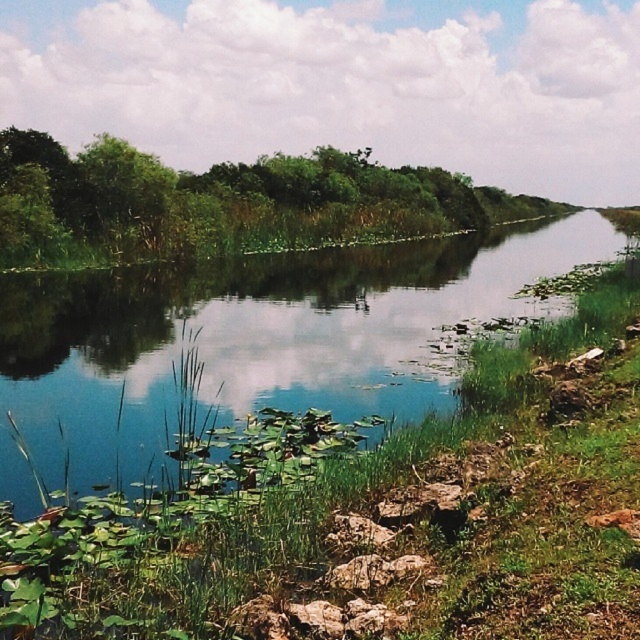
Can you confirm if green leafy trees at left is bigger than green leafy tree at upper left?

Yes.

Who is more forward, (44, 195) or (163, 204)?

Point (44, 195) is more forward.

Where is `green leafy trees at left`? The height and width of the screenshot is (640, 640). green leafy trees at left is located at coordinates (224, 204).

Which is more to the right, green grassy river at center or green leafy trees at left?

green leafy trees at left is more to the right.

Who is lower down, green grassy river at center or green leafy trees at left?

green grassy river at center is lower down.

Describe the element at coordinates (257, 340) in the screenshot. The image size is (640, 640). I see `green grassy river at center` at that location.

Find the location of a particular element. green grassy river at center is located at coordinates (257, 340).

Who is positioned more to the right, green grassy river at center or green leafy tree at upper left?

green grassy river at center

Is point (420, 298) positioned before point (140, 202)?

Yes.

Does point (32, 392) lie in front of point (154, 202)?

Yes, it is in front of point (154, 202).

Where is `green grassy river at center`? Image resolution: width=640 pixels, height=640 pixels. green grassy river at center is located at coordinates (257, 340).